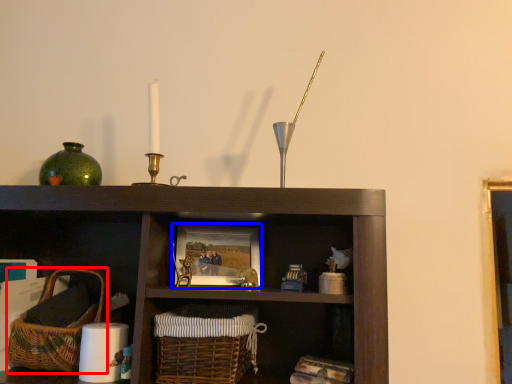
Question: Which point is closer to the camera, basket (highlighted by a red box) or picture frame (highlighted by a blue box)?

Choices:
 (A) basket
 (B) picture frame

Answer: (A)